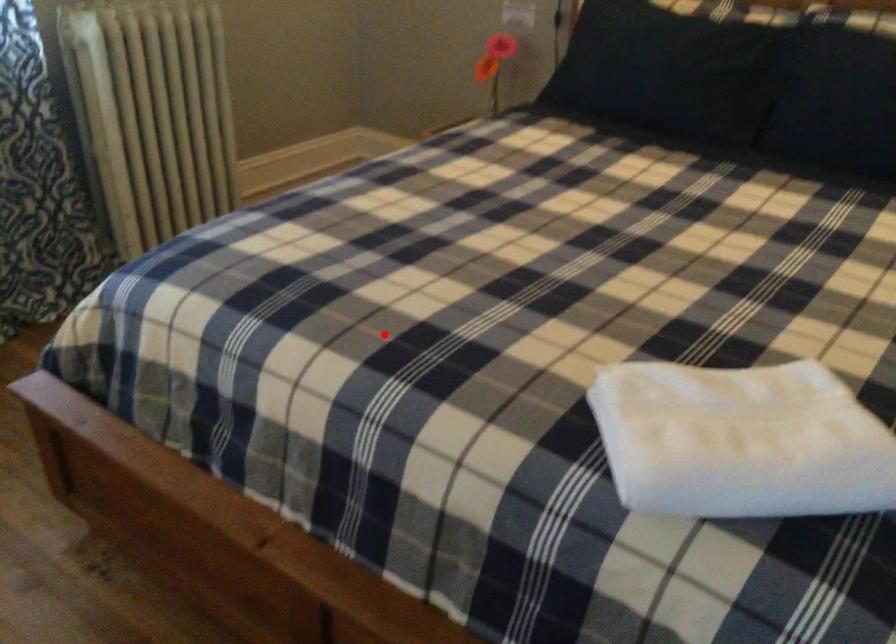
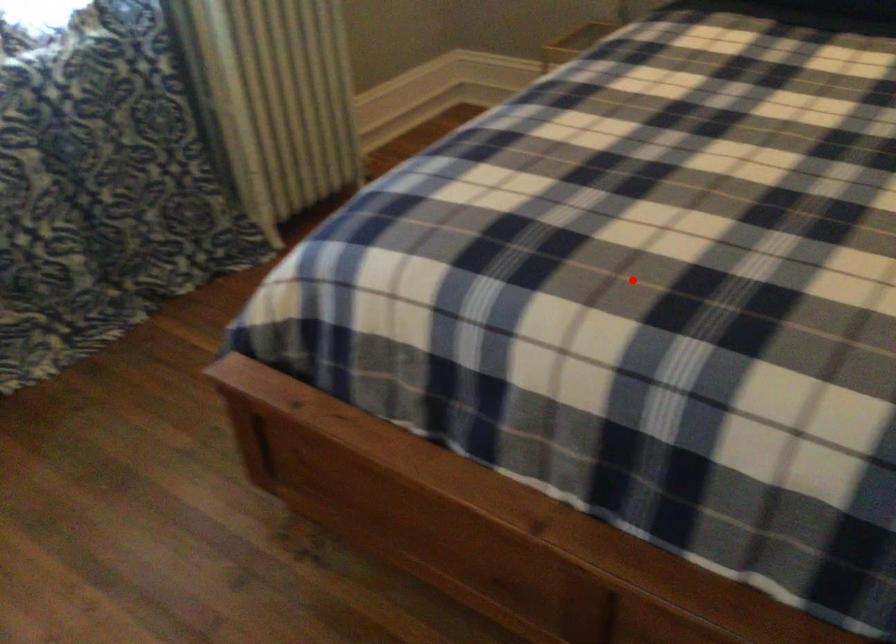
I am providing you with two images of the same scene from different viewpoints. A red point is marked on the first image and another point is marked on the second image. Does the point marked in image1 correspond to the same location as the one in image2?

Yes